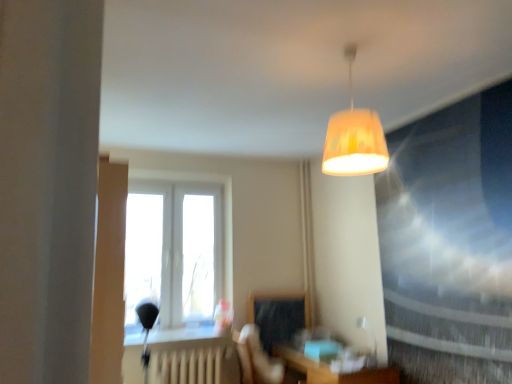
Question: Can you confirm if white plastic window at center is wider than matte yellow lampshade at center?

Choices:
 (A) no
 (B) yes

Answer: (A)

Question: From the image's perspective, is white plastic window at center located beneath matte yellow lampshade at center?

Choices:
 (A) no
 (B) yes

Answer: (B)

Question: Is white plastic window at center to the right of matte yellow lampshade at center from the viewer's perspective?

Choices:
 (A) no
 (B) yes

Answer: (A)

Question: Does white plastic window at center have a smaller size compared to matte yellow lampshade at center?

Choices:
 (A) yes
 (B) no

Answer: (B)

Question: Considering the relative positions of white plastic window at center and matte yellow lampshade at center in the image provided, is white plastic window at center to the left of matte yellow lampshade at center from the viewer's perspective?

Choices:
 (A) no
 (B) yes

Answer: (B)

Question: Does white plastic window at center lie behind matte yellow lampshade at center?

Choices:
 (A) no
 (B) yes

Answer: (B)

Question: Does matte black swivel chair at center come behind matte yellow lampshade at center?

Choices:
 (A) yes
 (B) no

Answer: (A)

Question: Is matte black swivel chair at center positioned with its back to matte yellow lampshade at center?

Choices:
 (A) yes
 (B) no

Answer: (B)

Question: From the image's perspective, is matte black swivel chair at center beneath matte yellow lampshade at center?

Choices:
 (A) yes
 (B) no

Answer: (A)

Question: From the image's perspective, is matte black swivel chair at center on matte yellow lampshade at center?

Choices:
 (A) no
 (B) yes

Answer: (A)

Question: Considering the relative sizes of matte black swivel chair at center and matte yellow lampshade at center in the image provided, is matte black swivel chair at center shorter than matte yellow lampshade at center?

Choices:
 (A) no
 (B) yes

Answer: (B)

Question: Is matte black swivel chair at center not close to matte yellow lampshade at center?

Choices:
 (A) yes
 (B) no

Answer: (A)

Question: Considering the relative sizes of matte glass window screen at upper right and white matte radiator at lower center in the image provided, is matte glass window screen at upper right taller than white matte radiator at lower center?

Choices:
 (A) yes
 (B) no

Answer: (A)